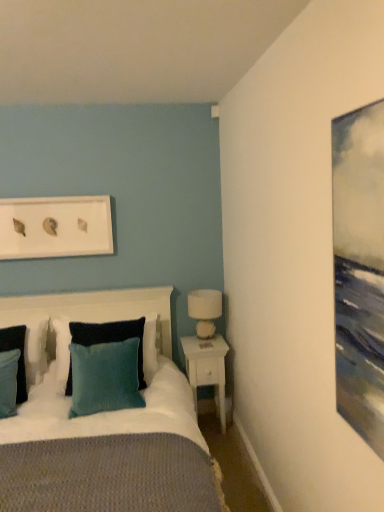
Locate an element on the screen. The image size is (384, 512). free point above white ceramic table lamp at right (from a real-world perspective) is located at coordinates 203,293.